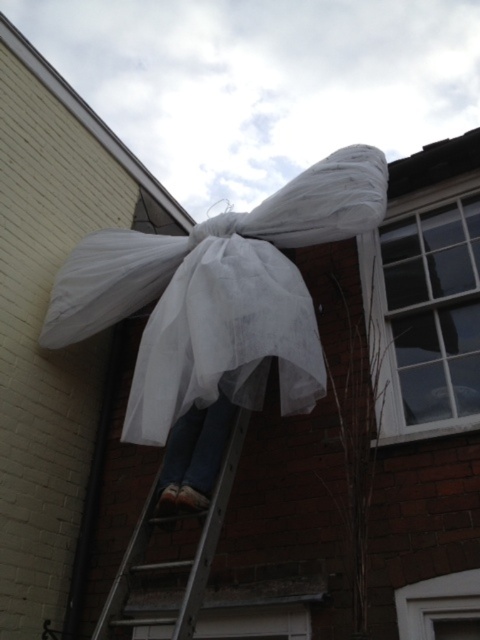
Is white sheer fabric at upper center below silver metallic ladder at center?

No.

The height and width of the screenshot is (640, 480). I want to click on white sheer fabric at upper center, so click(219, 296).